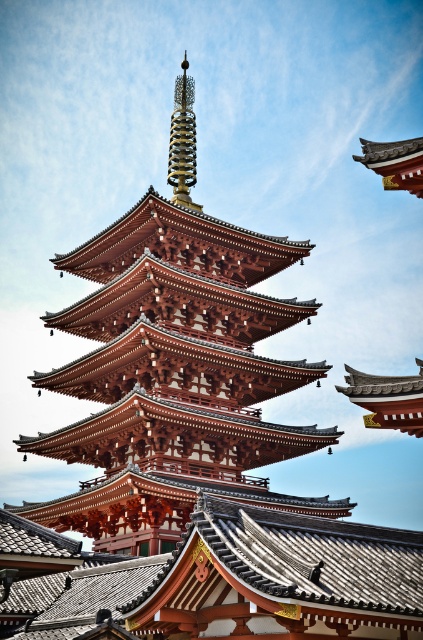
Does matte red pagoda at center have a lesser height compared to gold spiral spire at center?

Yes.

Which is more to the right, matte red pagoda at center or gold spiral spire at center?

Positioned to the right is gold spiral spire at center.

Is point (274, 376) farther from camera compared to point (194, 118)?

That is False.

Find the location of a particular element. matte red pagoda at center is located at coordinates (173, 376).